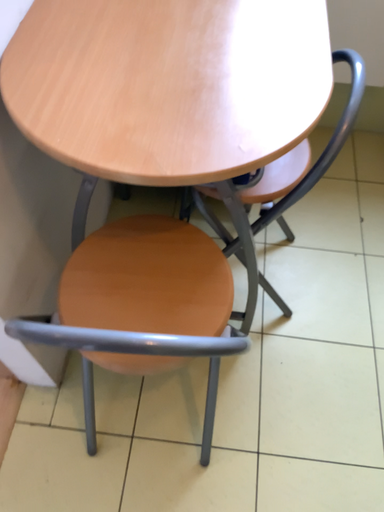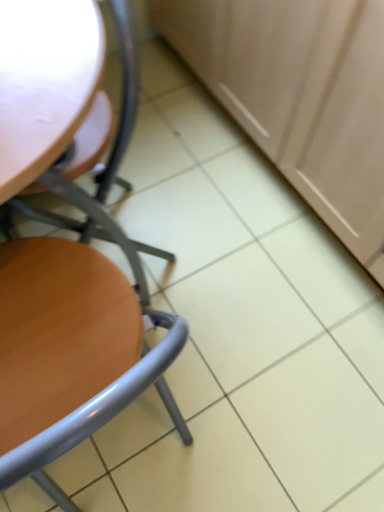
Question: How did the camera likely rotate when shooting the video?

Choices:
 (A) rotated right
 (B) rotated left

Answer: (A)